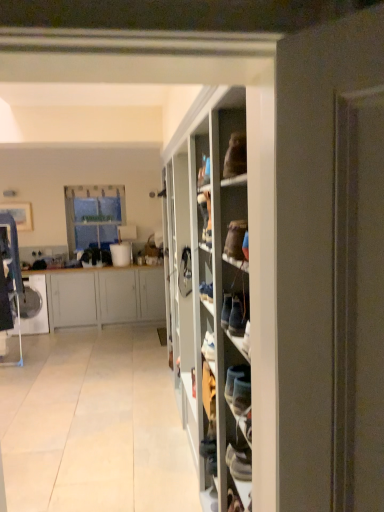
Question: Is white matte cabinet at left inside or outside of white fabric shoe at center?

Choices:
 (A) outside
 (B) inside

Answer: (A)

Question: From the image's perspective, is white matte cabinet at left located above or below white fabric shoe at center?

Choices:
 (A) above
 (B) below

Answer: (B)

Question: Estimate the real-world distances between objects in this image. Which object is farther from the white tile floor at center?

Choices:
 (A) white glossy washing machine at left
 (B) white fabric shoe at center
 (C) white matte cabinet at left
 (D) clear glass window at upper left

Answer: (D)

Question: Considering the real-world distances, which object is farthest from the clear glass window at upper left?

Choices:
 (A) white matte cabinet at left
 (B) white fabric shoe at center
 (C) white glossy washing machine at left
 (D) white tile floor at center

Answer: (B)